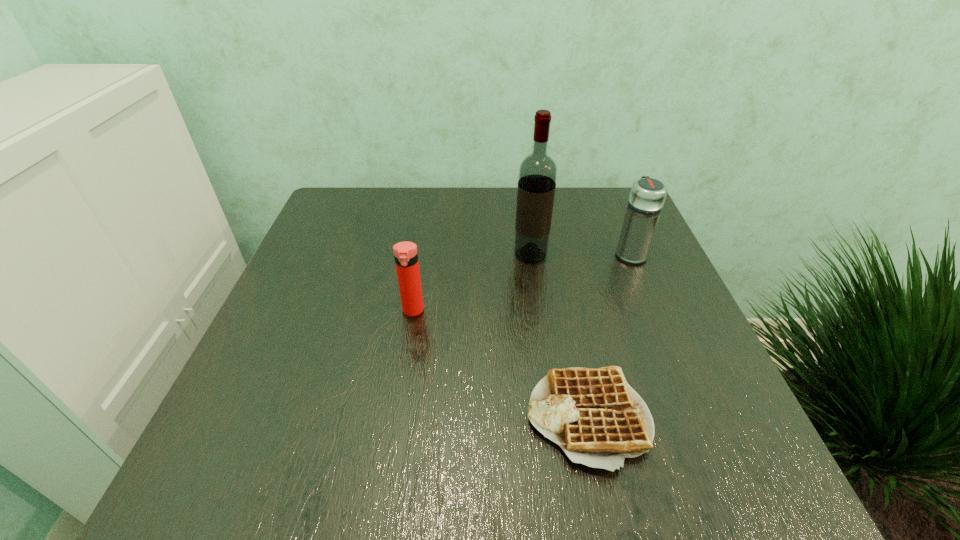
Image resolution: width=960 pixels, height=540 pixels. Find the location of `empty space between the farther thermos bottle and the nearer thermos bottle`. empty space between the farther thermos bottle and the nearer thermos bottle is located at coordinates (521, 282).

Identify which object is the third nearest to the leftmost object. Please provide its 2D coordinates. Your answer should be formatted as a tuple, i.e. [(x, y)], where the tuple contains the x and y coordinates of a point satisfying the conditions above.

[(647, 196)]

I want to click on the third closest object relative to the tallest object, so point(594,415).

At what (x,y) coordinates should I click in order to perform the action: click on free space that satisfies the following two spatial constraints: 1. on the back side of the left thermos bottle; 2. on the left side of the tallest object. Please return your answer as a coordinate pair (x, y). Looking at the image, I should click on (422, 255).